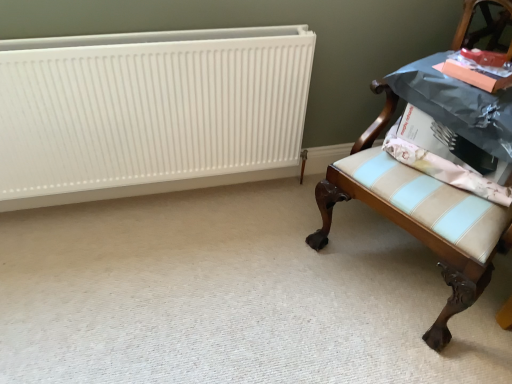
You are a GUI agent. You are given a task and a screenshot of the screen. Output one action in this format:
    pyautogui.click(x=<x>, y=<y>)
    Task: Click on the empty space that is ontop of white matte radiator at upper left
    
    Given the screenshot: What is the action you would take?
    pyautogui.click(x=93, y=35)